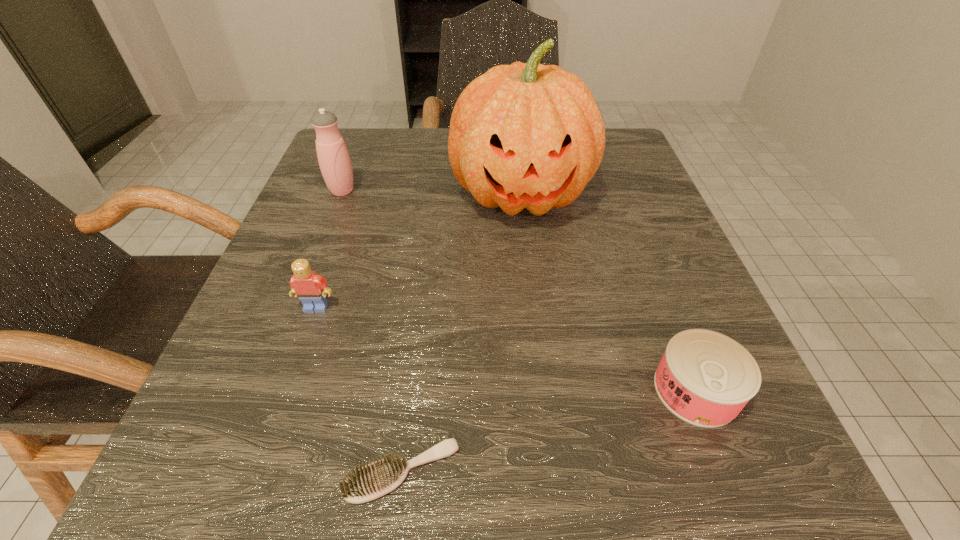
Locate an element on the screen. Image resolution: width=960 pixels, height=540 pixels. vacant point located between the fourth farthest object and the scrubbing brush is located at coordinates (549, 430).

This screenshot has width=960, height=540. What are the coordinates of `vacant region between the tallest object and the scrubbing brush` in the screenshot? It's located at (462, 333).

Locate an element on the screen. This screenshot has height=540, width=960. empty space that is in between the scrubbing brush and the thermos bottle is located at coordinates (372, 331).

Where is `free space between the shortest object and the fourth shortest object`? Image resolution: width=960 pixels, height=540 pixels. free space between the shortest object and the fourth shortest object is located at coordinates (372, 331).

The image size is (960, 540). In order to click on unoccupied position between the nearest object and the Lego in this screenshot , I will do `click(359, 389)`.

The height and width of the screenshot is (540, 960). I want to click on vacant space that is in between the second nearest object and the third shortest object, so click(506, 348).

Where is `free point between the third shortest object and the nearest object`? The height and width of the screenshot is (540, 960). free point between the third shortest object and the nearest object is located at coordinates (359, 389).

The height and width of the screenshot is (540, 960). I want to click on vacant region between the second tallest object and the can, so click(519, 290).

Identify the location of object that stands as the fourth closest to the can. The image size is (960, 540). (333, 157).

The width and height of the screenshot is (960, 540). In order to click on object that is the fourth nearest to the tallest object in this screenshot , I will do pyautogui.click(x=380, y=477).